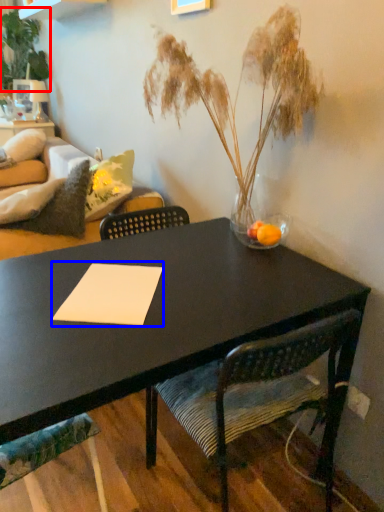
Question: Which of the following is the farthest to the observer, floral arrangement (highlighted by a red box) or notepad (highlighted by a blue box)?

Choices:
 (A) floral arrangement
 (B) notepad

Answer: (A)